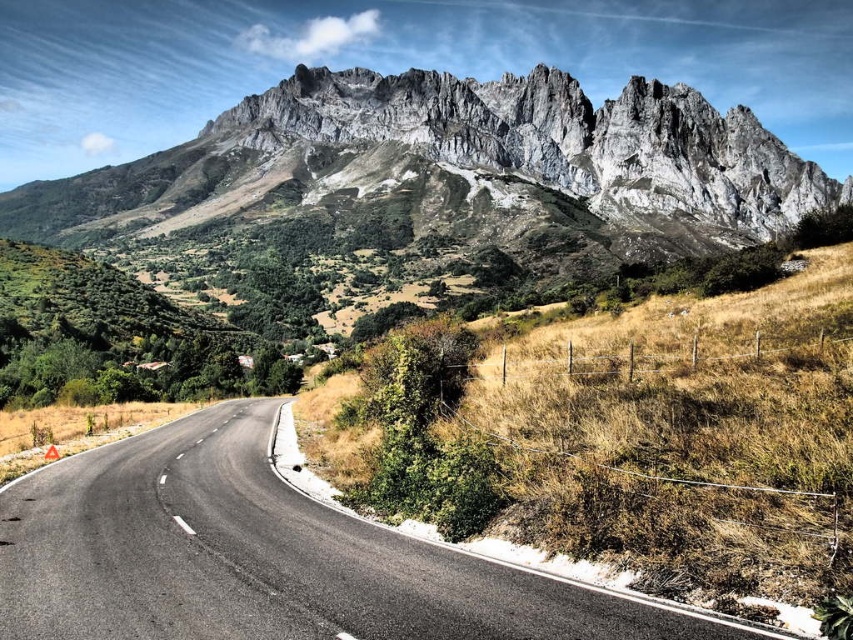
Can you confirm if rugged stone mountain range at upper center is taller than black asphalt road at center?

Yes, rugged stone mountain range at upper center is taller than black asphalt road at center.

Between point (741, 225) and point (279, 566), which one is positioned in front?

Point (279, 566) is in front.

Identify the location of rugged stone mountain range at upper center. (457, 170).